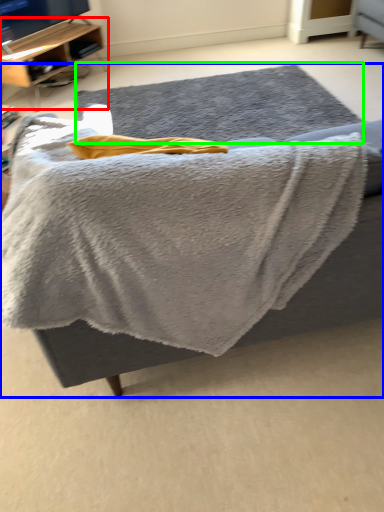
Question: Which object is positioned closest to shelf (highlighted by a red box)? Select from furniture (highlighted by a blue box) and mat (highlighted by a green box).

Choices:
 (A) furniture
 (B) mat

Answer: (A)